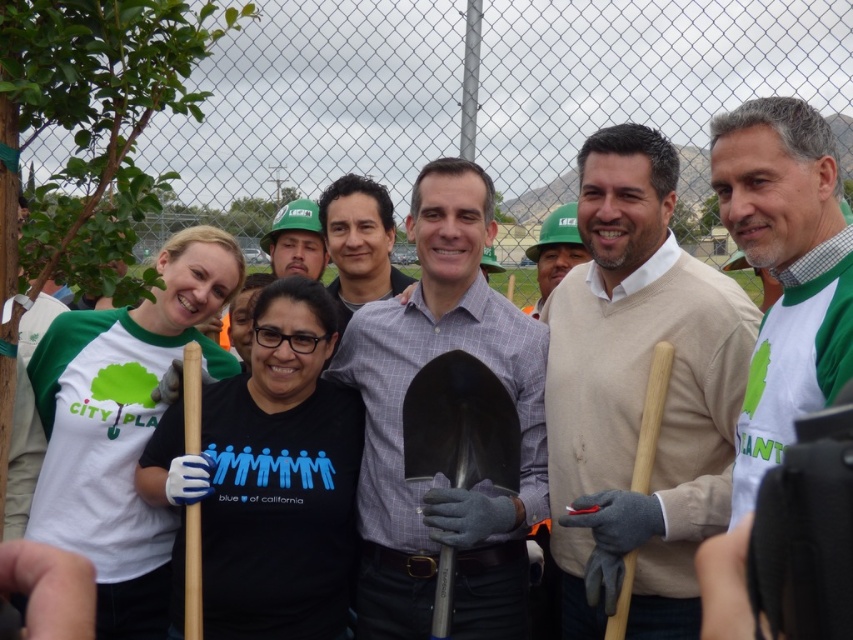
Question: From the image, what is the correct spatial relationship of beige sweater at center in relation to gray checkered shirt at center?

Choices:
 (A) above
 (B) below

Answer: (A)

Question: Estimate the real-world distances between objects in this image. Which object is farther from the matte black shirt at center?

Choices:
 (A) gray checkered shirt at center
 (B) green jersey at right

Answer: (B)

Question: Estimate the real-world distances between objects in this image. Which object is closer to the green jersey at right?

Choices:
 (A) matte black shirt at center
 (B) beige sweater at center
 (C) gray checkered shirt at center
 (D) polished metal shovel at center

Answer: (B)

Question: Among these points, which one is nearest to the camera?

Choices:
 (A) (358, 211)
 (B) (769, 324)
 (C) (608, 148)
 (D) (473, 384)

Answer: (B)

Question: Can you confirm if green jersey at right is positioned to the right of polished metal shovel at center?

Choices:
 (A) no
 (B) yes

Answer: (B)

Question: Does matte black shirt at center appear over wooden shovel at right?

Choices:
 (A) yes
 (B) no

Answer: (A)